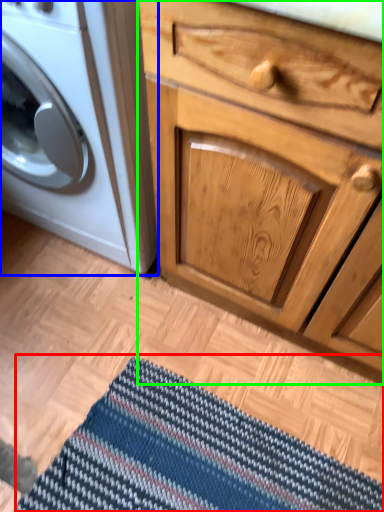
Question: Which is nearer to the doormat (highlighted by a red box)? washing machine (highlighted by a blue box) or chest of drawers (highlighted by a green box).

Choices:
 (A) washing machine
 (B) chest of drawers

Answer: (B)